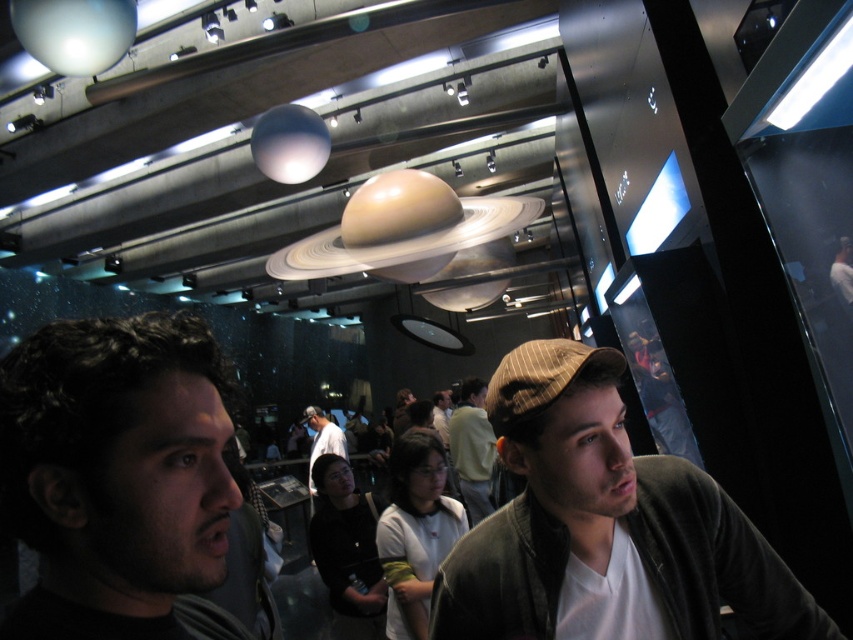
Question: Does dark brown hair at center have a larger size compared to brown striped hat at center?

Choices:
 (A) yes
 (B) no

Answer: (B)

Question: From the image, what is the correct spatial relationship of brown striped hat at center in relation to white shirt at center?

Choices:
 (A) above
 (B) below

Answer: (A)

Question: Estimate the real-world distances between objects in this image. Which object is farther from the black matte jacket at center?

Choices:
 (A) white shirt at center
 (B) dark brown hair at center

Answer: (A)

Question: Does brown striped hat at center have a greater width compared to white shirt at center?

Choices:
 (A) no
 (B) yes

Answer: (B)

Question: Among these objects, which one is farthest from the camera?

Choices:
 (A) brown striped hat at center
 (B) brown striped cap at center

Answer: (A)

Question: Which of these objects is positioned closest to the dark brown hair at center?

Choices:
 (A) white shirt at center
 (B) brown striped cap at center
 (C) brown striped hat at center

Answer: (B)